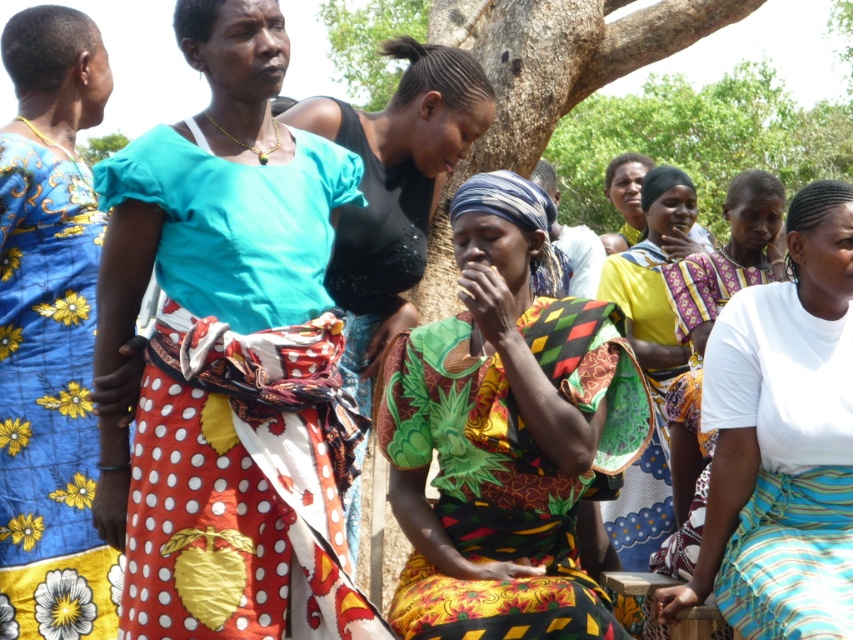
You are standing in the scene and want to find the matte teal blouse at center. Based on the coordinates provided, where should you look?

You should look at the coordinates point [229,356] to find the matte teal blouse at center.

You are a photographer standing at the edge of the gathering, wanting to capture both the matte teal blouse at center and the white cotton shirt at center in a single frame. Given that your camera has a maximum focus range of 30 feet, can you fit both subjects within the frame without moving closer?

The matte teal blouse at center and the white cotton shirt at center are 29.05 feet apart. Since the distance between them is within the camera maximum focus range of 30 feet, you can fit both subjects within the frame without moving closer.

You are a photographer trying to capture both the matte teal blouse at center and the black sequined dress at center in a single frame. Given their sizes, which one should you focus on to ensure both are visible without cropping?

The matte teal blouse at center is larger in size than the black sequined dress at center, so you should focus on the matte teal blouse at center to ensure both are visible without cropping.